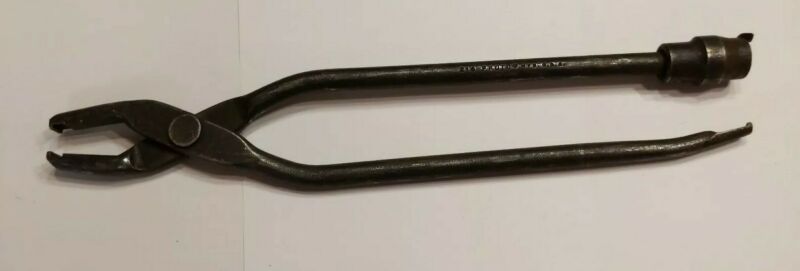
Where is `the lower handle`? The image size is (800, 271). the lower handle is located at coordinates (529, 162).